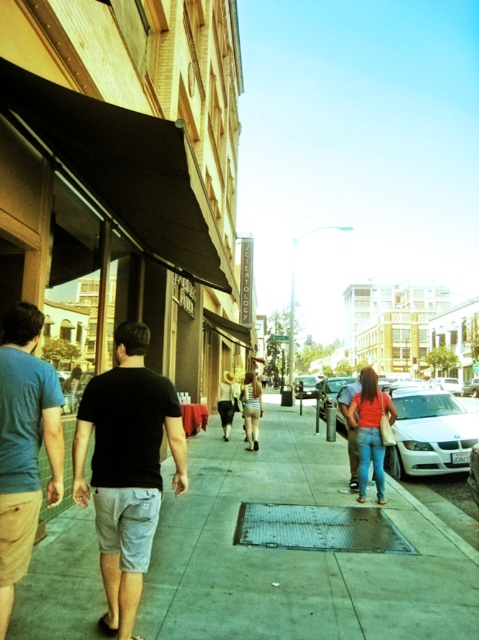
In the scene shown: Does white glossy sedan at center appear on the right side of metallic silver sedan at center?

Yes, white glossy sedan at center is to the right of metallic silver sedan at center.

Is white glossy sedan at center positioned before metallic silver sedan at center?

Yes.

Is point (386, 451) positioned before point (296, 385)?

Yes.

Find the location of a particular element. This screenshot has width=479, height=640. white glossy sedan at center is located at coordinates (430, 433).

How much distance is there between matte blue t-shirt at left and metallic silver sedan at center?

The distance of matte blue t-shirt at left from metallic silver sedan at center is 94.03 feet.

I want to click on matte blue t-shirt at left, so click(x=24, y=444).

Which is below, concrete sidewalk at center or striped fabric dress at center?

concrete sidewalk at center is below.

Where is `concrete sidewalk at center`? The image size is (479, 640). concrete sidewalk at center is located at coordinates (297, 550).